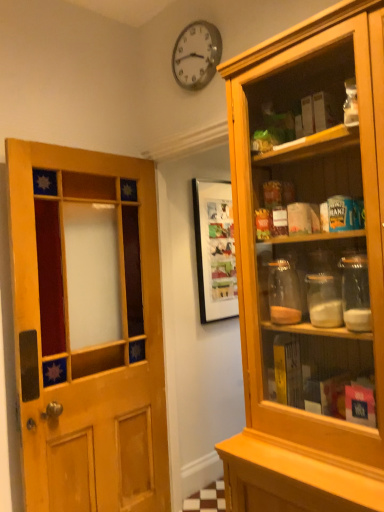
What is the approximate height of wooden door at left?

wooden door at left is 6.53 feet in height.

Locate an element on the screen. wooden door at left is located at coordinates (88, 344).

Describe the element at coordinates (88, 344) in the screenshot. I see `wooden door at left` at that location.

You are a GUI agent. You are given a task and a screenshot of the screen. Output one action in this format:
    pyautogui.click(x=<x>, y=<y>)
    Task: Click on the metallic clock at upper center
    
    Given the screenshot: What is the action you would take?
    pyautogui.click(x=196, y=55)

In the scene shown: What is the approximate height of metallic clock at upper center?

metallic clock at upper center is 14.70 inches in height.

What do you see at coordinates (196, 55) in the screenshot? I see `metallic clock at upper center` at bounding box center [196, 55].

I want to click on wooden door at left, so click(x=88, y=344).

Does metallic clock at upper center appear on the right side of wooden door at left?

Correct, you'll find metallic clock at upper center to the right of wooden door at left.

Relative to wooden door at left, is metallic clock at upper center in front or behind?

Clearly, metallic clock at upper center is behind wooden door at left.

Is point (207, 25) less distant than point (50, 265)?

Yes, point (207, 25) is closer to viewer.

From the picture: From the image's perspective, which object appears higher, metallic clock at upper center or wooden door at left?

metallic clock at upper center appears higher in the image.

From a real-world perspective, is metallic clock at upper center positioned over wooden door at left based on gravity?

Yes, from a real-world perspective, metallic clock at upper center is over wooden door at left

Considering the relative sizes of metallic clock at upper center and wooden door at left in the image provided, is metallic clock at upper center thinner than wooden door at left?

Correct, the width of metallic clock at upper center is less than that of wooden door at left.

Looking at this image, who is shorter, metallic clock at upper center or wooden door at left?

metallic clock at upper center.

Can you confirm if metallic clock at upper center is bigger than wooden door at left?

No.

Is metallic clock at upper center inside the boundaries of wooden door at left, or outside?

metallic clock at upper center cannot be found inside wooden door at left.

Is metallic clock at upper center touching wooden door at left?

They are not placed beside each other.

Is metallic clock at upper center facing towards wooden door at left?

No, metallic clock at upper center is not oriented towards wooden door at left.

In order to click on door below the metallic clock at upper center (from the image's perspective) in this screenshot , I will do `click(88, 344)`.

Does wooden door at left appear on the left side of metallic clock at upper center?

Yes.

Is wooden door at left closer to the viewer compared to metallic clock at upper center?

Yes, wooden door at left is in front of metallic clock at upper center.

Is point (150, 185) closer to viewer compared to point (220, 55)?

No, (150, 185) is further to viewer.

From the image's perspective, which is above, wooden door at left or metallic clock at upper center?

metallic clock at upper center appears higher in the image.

From a real-world perspective, is wooden door at left physically above metallic clock at upper center?

Incorrect, from a real-world perspective, wooden door at left is lower than metallic clock at upper center.

From the picture: Is wooden door at left thinner than metallic clock at upper center?

In fact, wooden door at left might be wider than metallic clock at upper center.

Can you confirm if wooden door at left is taller than metallic clock at upper center?

Indeed, wooden door at left has a greater height compared to metallic clock at upper center.

From the picture: Which of these two, wooden door at left or metallic clock at upper center, is bigger?

wooden door at left is bigger.

Is wooden door at left not within metallic clock at upper center?

wooden door at left lies outside metallic clock at upper center's area.

Are wooden door at left and metallic clock at upper center far apart?

Yes.

Is metallic clock at upper center at the back of wooden door at left?

wooden door at left is not turned away from metallic clock at upper center.

Identify the location of door located below the metallic clock at upper center (from the image's perspective). (88, 344).

Locate an element on the screen. door that is under the metallic clock at upper center (from a real-world perspective) is located at coordinates (88, 344).

At what (x,y) coordinates should I click in order to perform the action: click on door lying on the left of metallic clock at upper center. Please return your answer as a coordinate pair (x, y). Looking at the image, I should click on (88, 344).